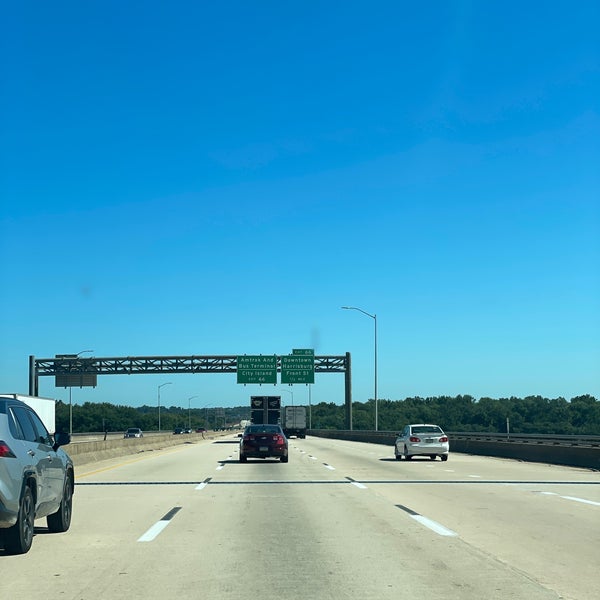
Find the location of a particular element. light is located at coordinates (343, 307).